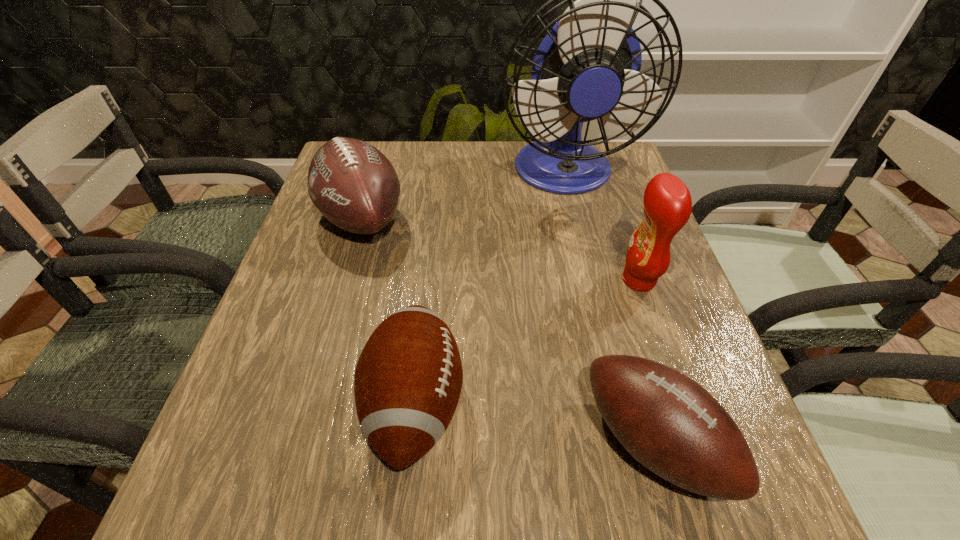
You are a GUI agent. You are given a task and a screenshot of the screen. Output one action in this format:
    pyautogui.click(x=<x>, y=<y>)
    Task: Click on the object that can be found as the closest to the rightmost football (American)
    The image size is (960, 540).
    Given the screenshot: What is the action you would take?
    pyautogui.click(x=667, y=201)

Locate an element on the screen. Image resolution: width=960 pixels, height=540 pixels. football (American) that is the second closest one to the rightmost football (American) is located at coordinates (354, 186).

Where is `football (American) object that ranks as the closest to the tallest object`? Image resolution: width=960 pixels, height=540 pixels. football (American) object that ranks as the closest to the tallest object is located at coordinates (354, 186).

The image size is (960, 540). I want to click on vacant region that satisfies the following two spatial constraints: 1. in front of the rightmost football (American) where the airflow is directed; 2. on the left side of the tallest object, so (x=628, y=442).